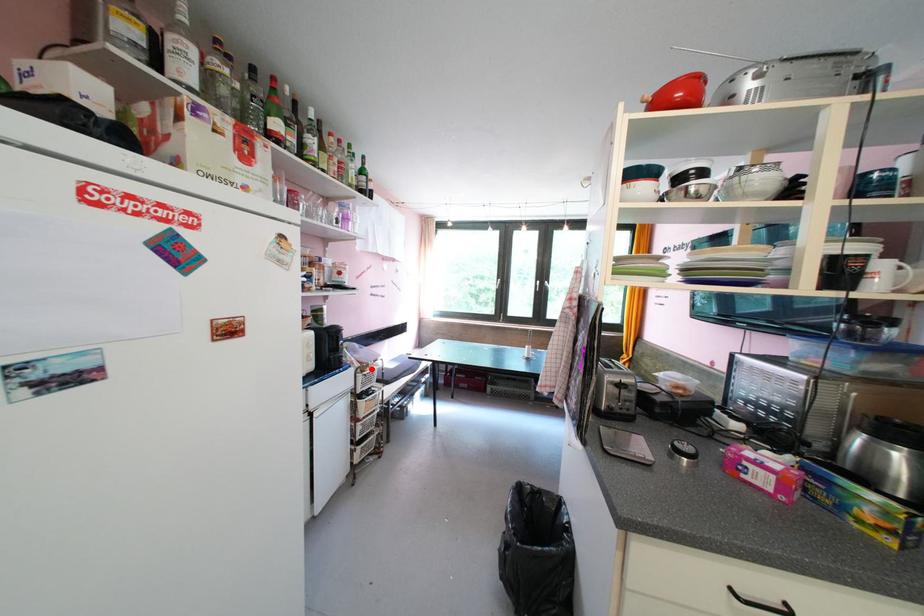
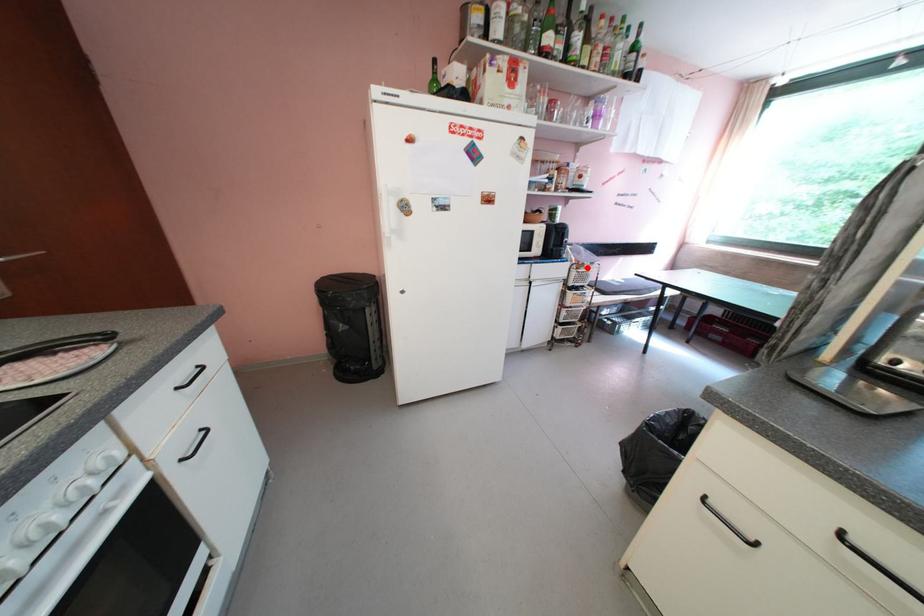
I am providing you with two images of the same scene from different viewpoints. A red point is marked on the first image and another point is marked on the second image. Is the red point in image1 aligned with the point shown in image2?

Yes